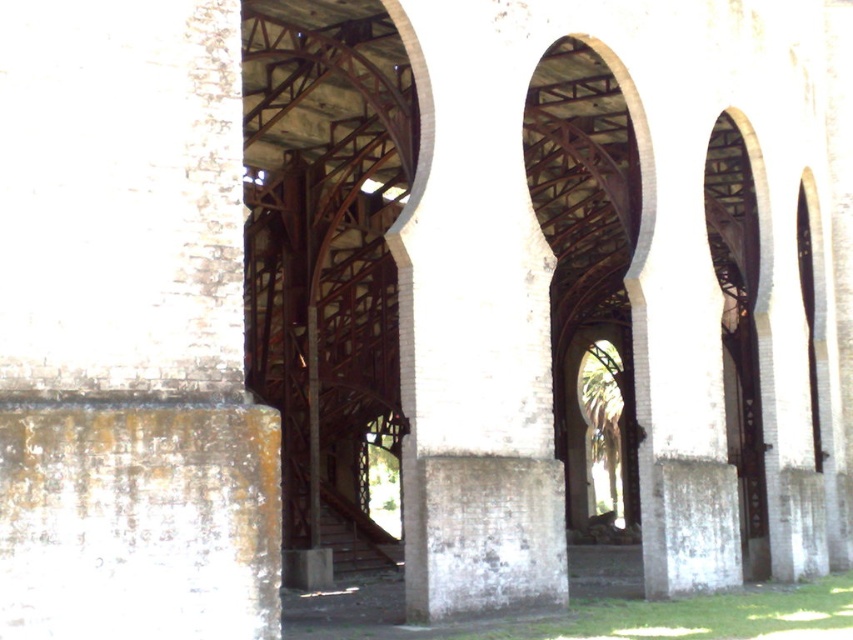
In the scene shown: You are an engineer inspecting the structure. You need to access the rusty metal bridge at center for maintenance. Which direction should you move from the white brick pillar at center to reach it?

The rusty metal bridge at center is positioned on the right side of white brick pillar at center, so you should move to the right from the white brick pillar at center to reach it.

You are an engineer assessing the structural integrity of the site. You need to determine which object is taller between the rusty metal bridge at center and the white brick pillar at center. Based on the scene, which one is taller?

The rusty metal bridge at center is taller than the white brick pillar at center.